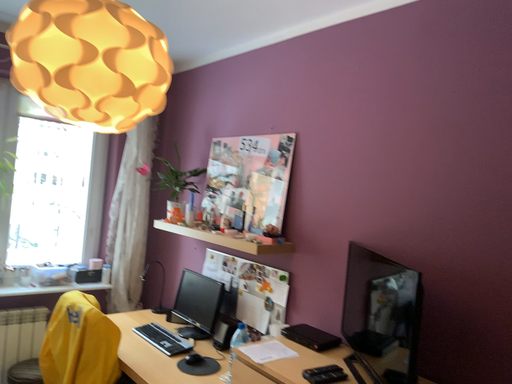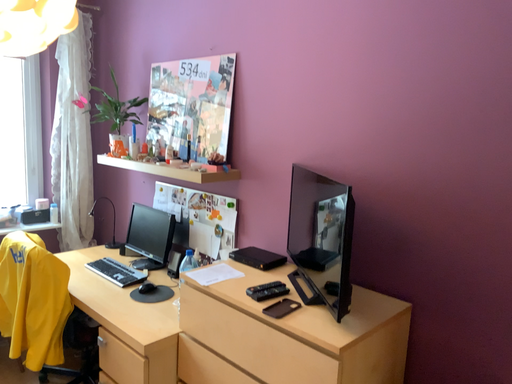
Question: Which way did the camera rotate in the video?

Choices:
 (A) rotated upward
 (B) rotated downward

Answer: (B)